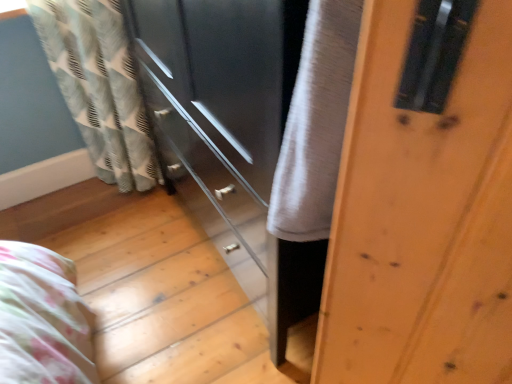
Identify the location of patterned fabric curtain at left. The height and width of the screenshot is (384, 512). (99, 86).

Describe the element at coordinates (99, 86) in the screenshot. I see `patterned fabric curtain at left` at that location.

Measure the distance between patterned fabric curtain at left and camera.

patterned fabric curtain at left and camera are 4.16 feet apart.

You are a GUI agent. You are given a task and a screenshot of the screen. Output one action in this format:
    pyautogui.click(x=<x>, y=<y>)
    Task: Click on the patterned fabric curtain at left
    This screenshot has height=384, width=512.
    Given the screenshot: What is the action you would take?
    pyautogui.click(x=99, y=86)